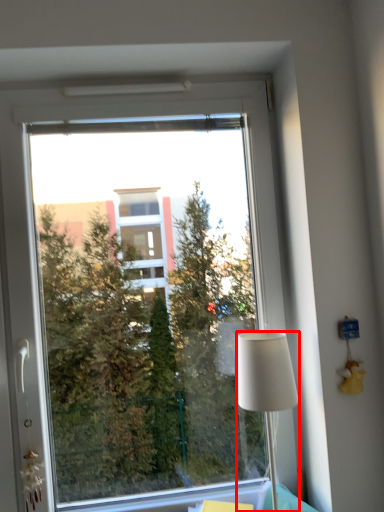
Question: In this image, where is lamp (annotated by the red box) located relative to window?

Choices:
 (A) left
 (B) right

Answer: (B)